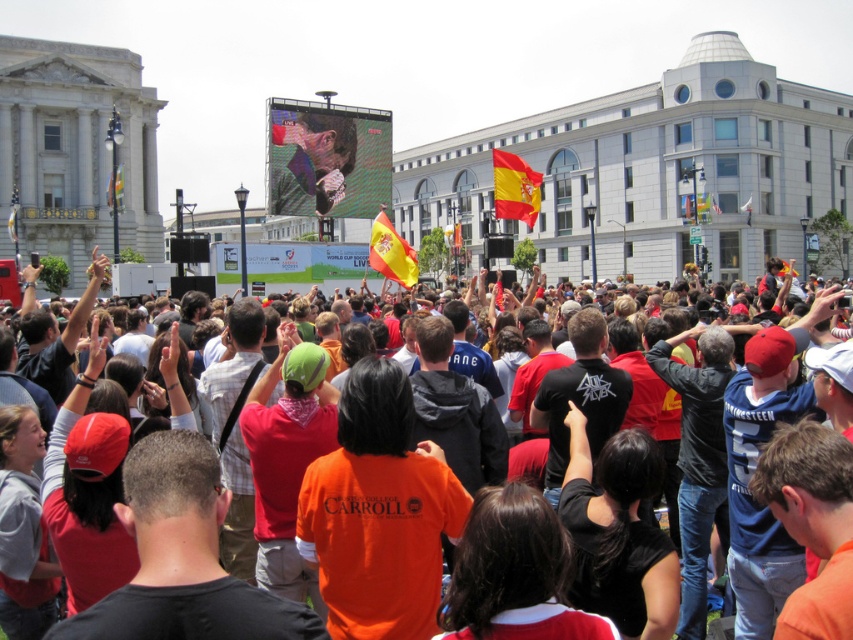
Is red fabric flag at center to the right of yellow fabric flag at center from the viewer's perspective?

Correct, you'll find red fabric flag at center to the right of yellow fabric flag at center.

Which is in front, point (500, 188) or point (112, 186)?

Positioned in front is point (112, 186).

This screenshot has width=853, height=640. In order to click on red fabric flag at center in this screenshot , I will do `click(515, 188)`.

Does matte black screen at center have a greater height compared to yellow fabric flag at center?

Indeed, matte black screen at center has a greater height compared to yellow fabric flag at center.

How far apart are matte black screen at center and yellow fabric flag at center?

They are 85.20 feet apart.

Does point (329, 131) come closer to viewer compared to point (113, 200)?

No, it is behind (113, 200).

The height and width of the screenshot is (640, 853). I want to click on matte black screen at center, so click(x=320, y=152).

Does matte black screen at center appear on the right side of red fabric flag at center?

Incorrect, matte black screen at center is not on the right side of red fabric flag at center.

Who is shorter, matte black screen at center or red fabric flag at center?

red fabric flag at center is shorter.

Locate an element on the screen. This screenshot has width=853, height=640. matte black screen at center is located at coordinates (320, 152).

Locate an element on the screen. This screenshot has width=853, height=640. matte black screen at center is located at coordinates (320, 152).